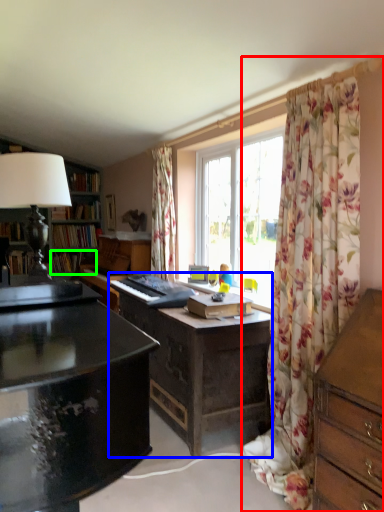
Question: Considering the real-world distances, which object is closest to curtain (highlighted by a red box)? desk (highlighted by a blue box) or book (highlighted by a green box).

Choices:
 (A) desk
 (B) book

Answer: (A)